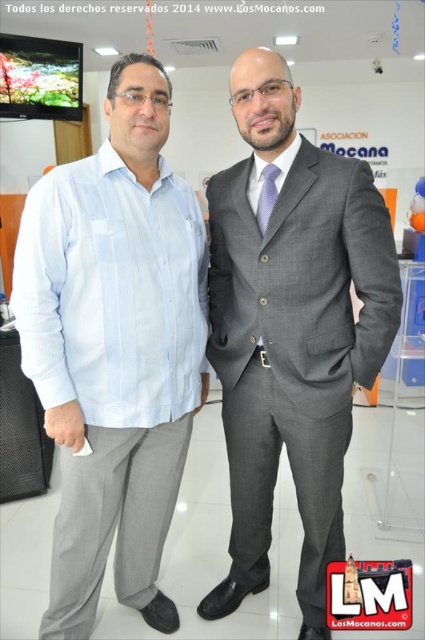
Question: Which object is farther from the camera taking this photo?

Choices:
 (A) light blue silk tie at center
 (B) matte light blue shirt at left

Answer: (A)

Question: Which point is farther to the camera?

Choices:
 (A) (367, 257)
 (B) (122, 333)
 (C) (271, 170)

Answer: (C)

Question: Which object is positioned closest to the gray wool suit at center?

Choices:
 (A) light blue silk tie at center
 (B) matte light blue shirt at left

Answer: (B)

Question: Observing the image, what is the correct spatial positioning of matte light blue shirt at left in reference to light blue silk tie at center?

Choices:
 (A) right
 (B) left

Answer: (B)

Question: Does matte light blue shirt at left have a greater width compared to light blue silk tie at center?

Choices:
 (A) no
 (B) yes

Answer: (B)

Question: From the image, what is the correct spatial relationship of gray wool suit at center in relation to light blue silk tie at center?

Choices:
 (A) above
 (B) below

Answer: (B)